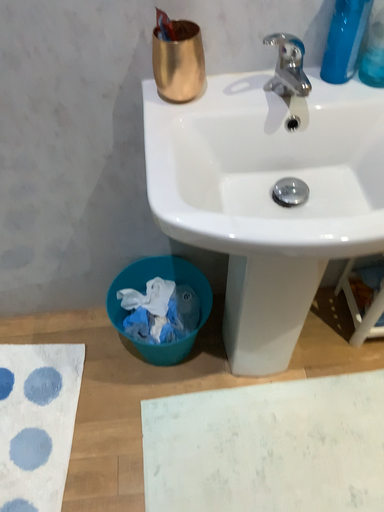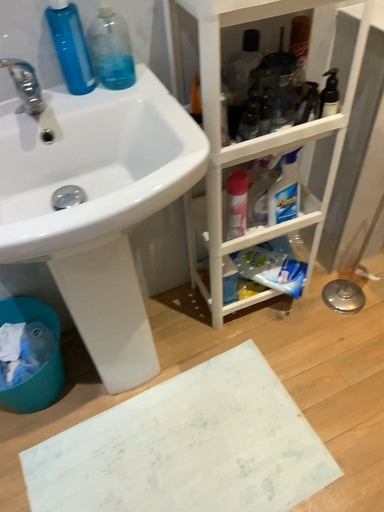
Question: Which way did the camera rotate in the video?

Choices:
 (A) rotated right
 (B) rotated left

Answer: (A)